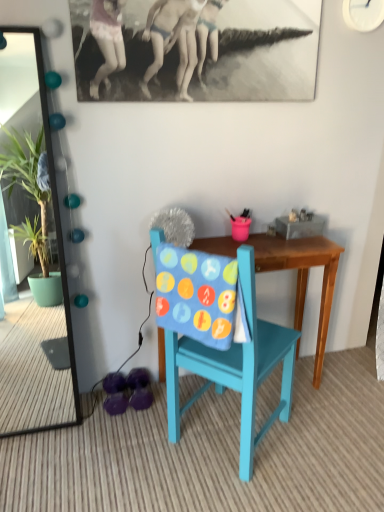
Question: Is teal painted wood chair at center at the back of wooden table at center?

Choices:
 (A) no
 (B) yes

Answer: (B)

Question: Can you confirm if wooden table at center is taller than teal painted wood chair at center?

Choices:
 (A) no
 (B) yes

Answer: (A)

Question: Would you say teal painted wood chair at center is part of wooden table at center's contents?

Choices:
 (A) no
 (B) yes

Answer: (A)

Question: Is wooden table at center thinner than teal painted wood chair at center?

Choices:
 (A) yes
 (B) no

Answer: (A)

Question: From the image's perspective, is wooden table at center over teal painted wood chair at center?

Choices:
 (A) no
 (B) yes

Answer: (B)

Question: Based on their positions, is green glossy mirror at left located to the left or right of wooden table at center?

Choices:
 (A) right
 (B) left

Answer: (B)

Question: Does point (54, 183) appear closer or farther from the camera than point (281, 241)?

Choices:
 (A) closer
 (B) farther

Answer: (A)

Question: From a real-world perspective, relative to wooden table at center, is green glossy mirror at left vertically above or below?

Choices:
 (A) above
 (B) below

Answer: (A)

Question: Considering the positions of green glossy mirror at left and wooden table at center in the image, is green glossy mirror at left wider or thinner than wooden table at center?

Choices:
 (A) wide
 (B) thin

Answer: (B)

Question: Would you say wooden table at center is to the left or to the right of green glossy mirror at left in the picture?

Choices:
 (A) right
 (B) left

Answer: (A)

Question: Based on their sizes in the image, would you say wooden table at center is bigger or smaller than green glossy mirror at left?

Choices:
 (A) big
 (B) small

Answer: (A)

Question: From a real-world perspective, is wooden table at center positioned above or below green glossy mirror at left?

Choices:
 (A) below
 (B) above

Answer: (A)

Question: From the image's perspective, is wooden table at center above or below green glossy mirror at left?

Choices:
 (A) below
 (B) above

Answer: (A)

Question: Is wooden table at center taller or shorter than teal painted wood chair at center?

Choices:
 (A) short
 (B) tall

Answer: (A)

Question: Relative to teal painted wood chair at center, is wooden table at center in front or behind?

Choices:
 (A) behind
 (B) front

Answer: (A)